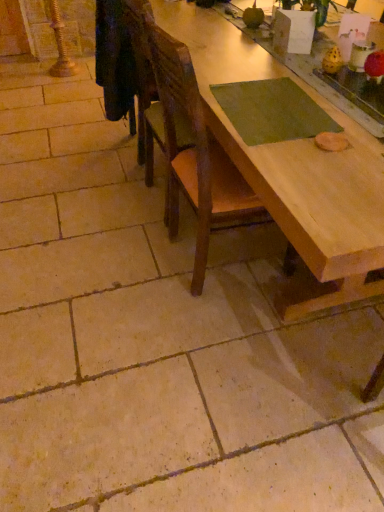
I want to click on free space to the left of wooden chair at center, so click(x=121, y=263).